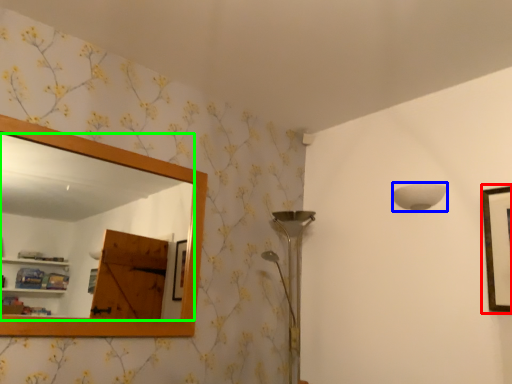
Question: Based on their relative distances, which object is farther from picture frame (highlighted by a red box)? Choose from lamp (highlighted by a blue box) and mirror (highlighted by a green box).

Choices:
 (A) lamp
 (B) mirror

Answer: (B)